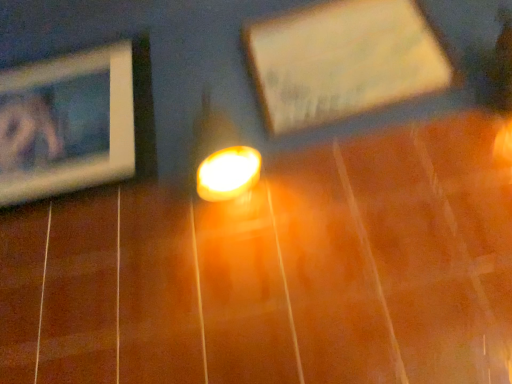
Question: Looking at their shapes, would you say wooden picture frame at left, placed as the first picture frame when sorted from left to right, is wider or thinner than wooden picture frame at upper center, which is the second picture frame from left to right?

Choices:
 (A) wide
 (B) thin

Answer: (B)

Question: Considering the positions of wooden picture frame at left, placed as the first picture frame when sorted from left to right, and wooden picture frame at upper center, which is the second picture frame from left to right, in the image, is wooden picture frame at left, placed as the first picture frame when sorted from left to right, bigger or smaller than wooden picture frame at upper center, which is the second picture frame from left to right,?

Choices:
 (A) small
 (B) big

Answer: (B)

Question: From the image's perspective, relative to wooden picture frame at upper center, which is the second picture frame from left to right, is wooden picture frame at left, the 2th picture frame when ordered from right to left, above or below?

Choices:
 (A) below
 (B) above

Answer: (A)

Question: From the image's perspective, is wooden picture frame at upper center, which is the second picture frame from left to right, located above or below wooden picture frame at left, the 2th picture frame when ordered from right to left?

Choices:
 (A) above
 (B) below

Answer: (A)

Question: From a real-world perspective, is wooden picture frame at upper center, marked as the first picture frame in a right-to-left arrangement, positioned above or below wooden picture frame at left, the 2th picture frame when ordered from right to left?

Choices:
 (A) below
 (B) above

Answer: (A)

Question: Visually, is wooden picture frame at upper center, marked as the first picture frame in a right-to-left arrangement, positioned to the left or to the right of wooden picture frame at left, the 2th picture frame when ordered from right to left?

Choices:
 (A) right
 (B) left

Answer: (A)

Question: In terms of height, does wooden picture frame at upper center, marked as the first picture frame in a right-to-left arrangement, look taller or shorter compared to wooden picture frame at left, the 2th picture frame when ordered from right to left?

Choices:
 (A) short
 (B) tall

Answer: (A)